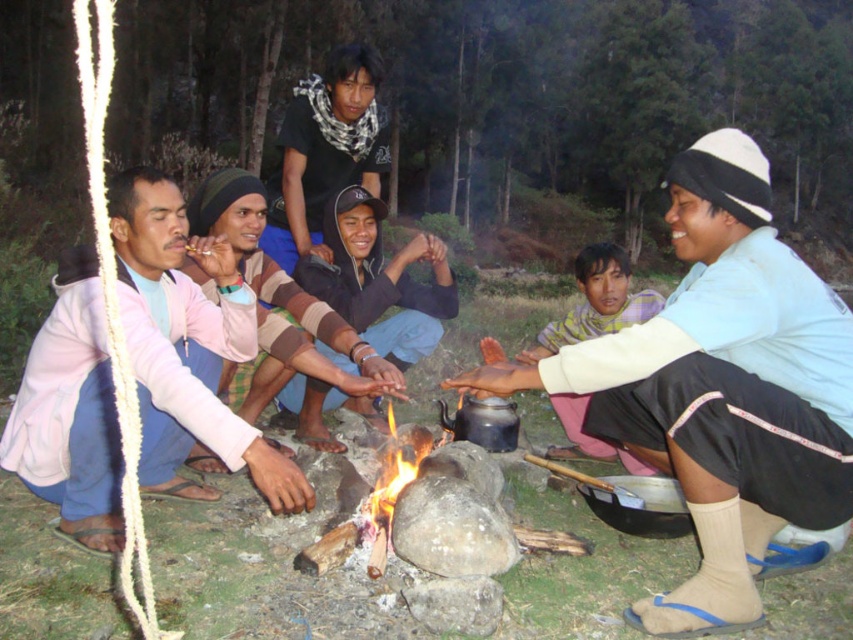
Is light blue cotton shirt at center thinner than matte black jacket at center?

No.

Is light blue cotton shirt at center positioned before matte black jacket at center?

Yes, light blue cotton shirt at center is closer to the viewer.

The width and height of the screenshot is (853, 640). What do you see at coordinates (721, 387) in the screenshot?
I see `light blue cotton shirt at center` at bounding box center [721, 387].

Locate an element on the screen. This screenshot has height=640, width=853. light blue cotton shirt at center is located at coordinates (721, 387).

Between matte black jacket at center and purple striped shirt at center, which one is positioned lower?

purple striped shirt at center

Can you confirm if matte black jacket at center is bigger than purple striped shirt at center?

No, matte black jacket at center is not bigger than purple striped shirt at center.

Between point (378, 296) and point (578, 262), which one is positioned in front?

Point (378, 296)

At what (x,y) coordinates should I click in order to perform the action: click on matte black jacket at center. Please return your answer as a coordinate pair (x, y). This screenshot has height=640, width=853. Looking at the image, I should click on (379, 280).

Can you confirm if pink fabric pants at lower left is positioned above brown striped sweater at center?

No.

Measure the distance from pink fabric pants at lower left to brown striped sweater at center.

pink fabric pants at lower left and brown striped sweater at center are 51.95 centimeters apart from each other.

Between point (216, 400) and point (282, 342), which one is positioned in front?

Point (216, 400) is in front.

Find the location of `pink fabric pants at lower left`. pink fabric pants at lower left is located at coordinates (186, 344).